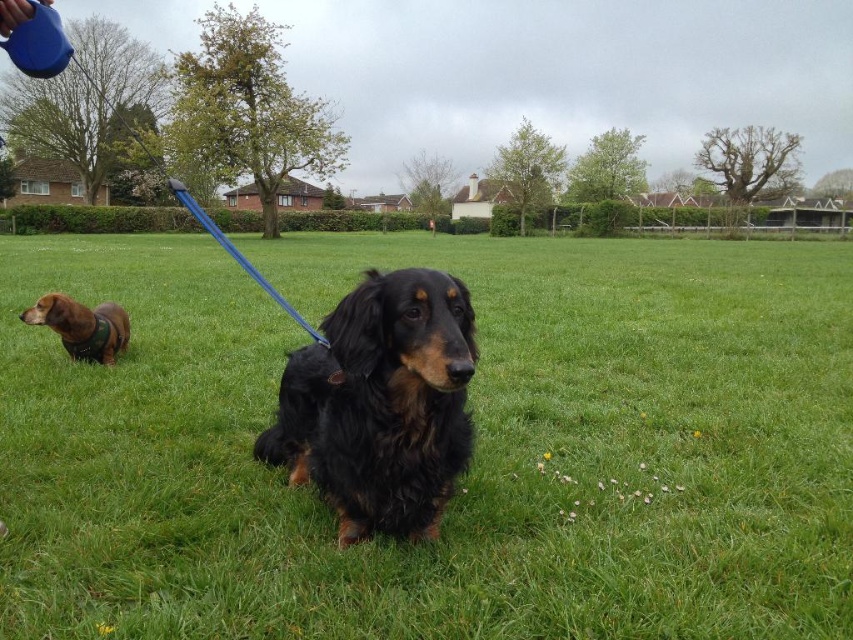
Question: Which is nearer to the green grass at center?

Choices:
 (A) shiny black fur at center
 (B) brown fur dog at left

Answer: (B)

Question: Which point appears farthest from the camera in this image?

Choices:
 (A) (820, 364)
 (B) (50, 305)

Answer: (A)

Question: Can you confirm if green grass at center is wider than shiny black fur at center?

Choices:
 (A) yes
 (B) no

Answer: (A)

Question: Which of the following is the closest to the observer?

Choices:
 (A) (109, 317)
 (B) (22, 500)
 (C) (462, 355)

Answer: (C)

Question: Where is shiny black fur at center located in relation to brown fur dog at left in the image?

Choices:
 (A) below
 (B) above

Answer: (A)

Question: Observing the image, what is the correct spatial positioning of green grass at center in reference to shiny black fur at center?

Choices:
 (A) right
 (B) left

Answer: (B)